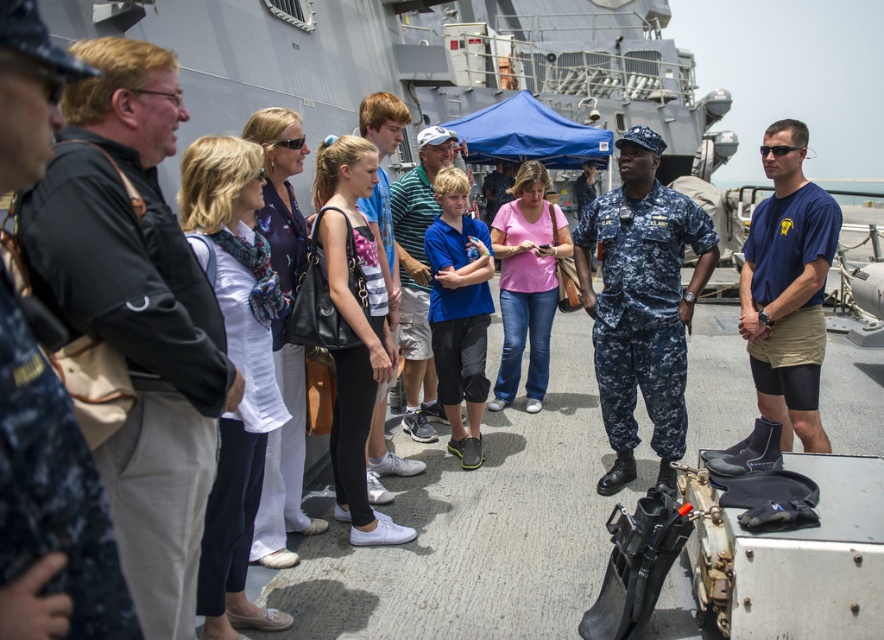
You are a photographer trying to capture a clear shot of the black leather jacket at left and the dull blue camouflage uniform at center. Since you want both subjects to be in focus, you need to adjust your camera settings. Considering their thickness, which object might require more careful focus adjustment due to its size?

The black leather jacket at left is thinner than the dull blue camouflage uniform at center, so the thinner object, the black leather jacket at left, might require more careful focus adjustment because it has less depth compared to the thicker uniform.

You are a tour guide on the naval ship deck. You need to hand out a pamphlet to the person wearing the black leather jacket at left and the person in the dull blue camouflage uniform at center. If your arm can reach 3 meters, can you reach both without moving?

The black leather jacket at left is 3.49 meters away from the dull blue camouflage uniform at center. Since your arm can only reach 3 meters, you cannot reach both without moving.

You are organizing a group photo and need to arrange the participants based on their shirt widths. Which participant should stand on the left side to accommodate their larger shirt width? Please refer to the blue striped shirt at center and the matte blue shirt at center.

The blue striped shirt at center should stand on the left side because its width is larger than the matte blue shirt at center.